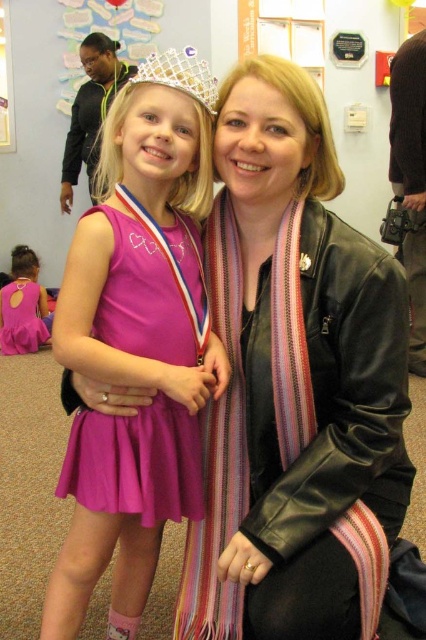
Who is positioned more to the left, purple satin dress at center or matte black jacket at upper left?

From the viewer's perspective, matte black jacket at upper left appears more on the left side.

Does purple satin dress at center have a lesser width compared to matte black jacket at upper left?

Yes.

Between point (65, 481) and point (98, 68), which one is positioned in front?

Point (65, 481) is more forward.

Image resolution: width=426 pixels, height=640 pixels. In order to click on purple satin dress at center in this screenshot , I will do click(135, 464).

Is matte pink dress at center thinner than matte black jacket at upper left?

Yes, matte pink dress at center is thinner than matte black jacket at upper left.

Who is more distant from viewer, (169, 264) or (65, 180)?

Positioned behind is point (65, 180).

Where is `matte pink dress at center`? The image size is (426, 640). matte pink dress at center is located at coordinates (137, 340).

Measure the distance between point (322, 316) and camera.

A distance of 3.52 feet exists between point (322, 316) and camera.

The width and height of the screenshot is (426, 640). Find the location of `black leather jacket at center`. black leather jacket at center is located at coordinates (294, 384).